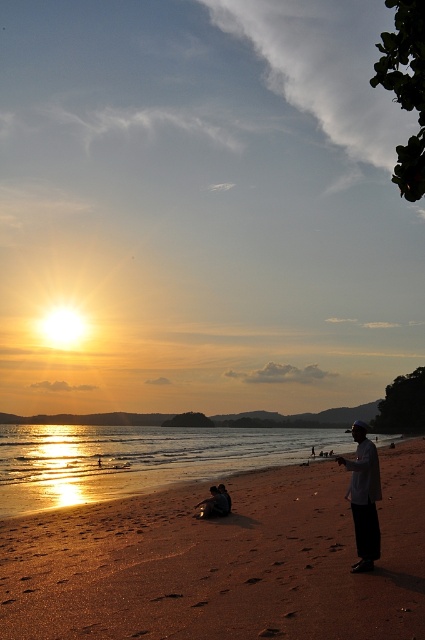
Is point (367, 605) farther from camera compared to point (353, 500)?

No, (367, 605) is in front of (353, 500).

The image size is (425, 640). Describe the element at coordinates (221, 561) in the screenshot. I see `brown sandy beach at lower center` at that location.

This screenshot has height=640, width=425. I want to click on brown sandy beach at lower center, so click(221, 561).

Between brown sandy beach at lower center and shiny metallic water at lower left, which one is positioned higher?

brown sandy beach at lower center is higher up.

What do you see at coordinates (221, 561) in the screenshot? This screenshot has width=425, height=640. I see `brown sandy beach at lower center` at bounding box center [221, 561].

Between point (289, 593) and point (119, 468), which one is positioned behind?

Positioned behind is point (119, 468).

You are a GUI agent. You are given a task and a screenshot of the screen. Output one action in this format:
    pyautogui.click(x=<x>, y=<y>)
    Task: Click on the brown sandy beach at lower center
    The width and height of the screenshot is (425, 640).
    Given the screenshot: What is the action you would take?
    pyautogui.click(x=221, y=561)

Who is more distant from viewer, (112,483) or (337,458)?

Positioned behind is point (112,483).

Does shiny metallic water at lower left have a lesser width compared to dark gray fabric at lower right?

No.

The height and width of the screenshot is (640, 425). Identify the location of shiny metallic water at lower left. (138, 460).

The height and width of the screenshot is (640, 425). I want to click on shiny metallic water at lower left, so click(138, 460).